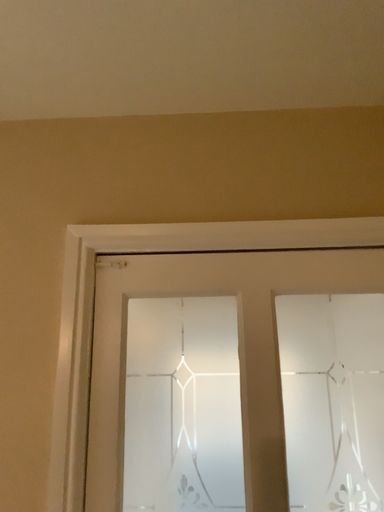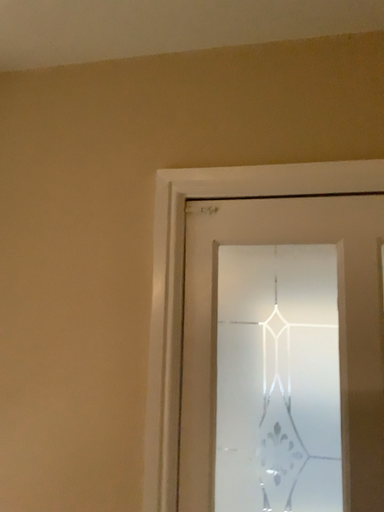
Question: Which way did the camera rotate in the video?

Choices:
 (A) rotated right
 (B) rotated left

Answer: (B)